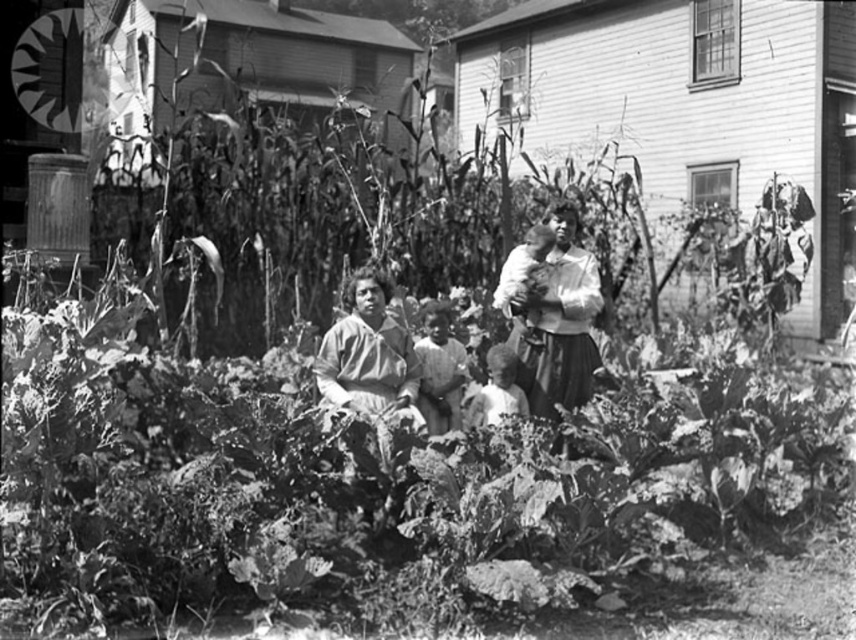
Is matte brown dress at center wider than smooth skin baby at center?

Yes, matte brown dress at center is wider than smooth skin baby at center.

Does point (379, 337) lie behind point (513, 282)?

No.

Which is behind, point (313, 371) or point (533, 260)?

The point (533, 260) is behind.

Find the location of a particular element. The height and width of the screenshot is (640, 856). matte brown dress at center is located at coordinates (367, 355).

Is point (531, 257) closer to viewer compared to point (503, 380)?

Yes, it is.

Image resolution: width=856 pixels, height=640 pixels. What are the coordinates of `smooth skin baby at center` in the screenshot? It's located at (525, 276).

You are a GUI agent. You are given a task and a screenshot of the screen. Output one action in this format:
    pyautogui.click(x=<x>, y=<y>)
    Task: Click on the smooth skin baby at center
    The image size is (856, 640).
    Given the screenshot: What is the action you would take?
    pyautogui.click(x=525, y=276)

Does smooth dark fabric dress at center have a larger size compared to smooth skin baby at center?

Yes.

Who is positioned more to the right, smooth dark fabric dress at center or smooth skin baby at center?

Positioned to the right is smooth dark fabric dress at center.

Between point (574, 304) and point (527, 321), which one is positioned behind?

Point (527, 321)

At what (x,y) coordinates should I click in order to perform the action: click on smooth dark fabric dress at center. Please return your answer as a coordinate pair (x, y). Looking at the image, I should click on (557, 321).